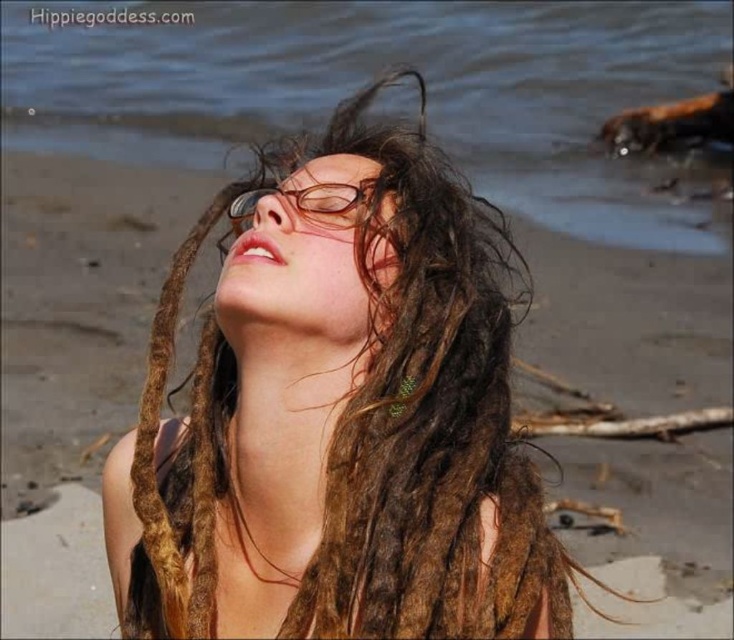
Question: Which of the following is the closest to the observer?

Choices:
 (A) brown plastic glasses at center
 (B) clear blue water at upper center

Answer: (A)

Question: Does brown dreadlocks at center appear on the left side of clear blue water at upper center?

Choices:
 (A) yes
 (B) no

Answer: (B)

Question: Does brown dreadlocks at center appear over brown plastic glasses at center?

Choices:
 (A) yes
 (B) no

Answer: (B)

Question: Which is nearer to the brown dreadlocks at center?

Choices:
 (A) clear blue water at upper center
 (B) brown plastic glasses at center

Answer: (B)

Question: Which point appears farthest from the camera in this image?

Choices:
 (A) (252, 294)
 (B) (291, 182)

Answer: (B)

Question: In this image, where is brown dreadlocks at center located relative to brown plastic glasses at center?

Choices:
 (A) below
 (B) above

Answer: (A)